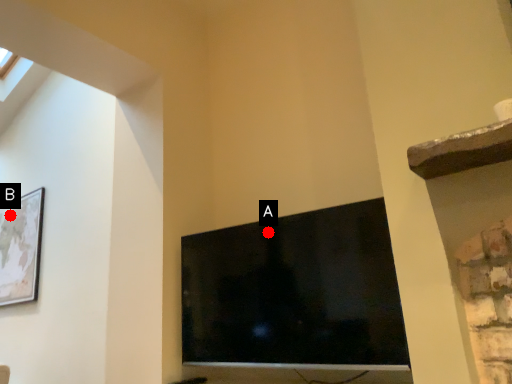
Question: Two points are circled on the image, labeled by A and B beside each circle. Which point appears farthest from the camera in this image?

Choices:
 (A) A is further
 (B) B is further

Answer: (B)